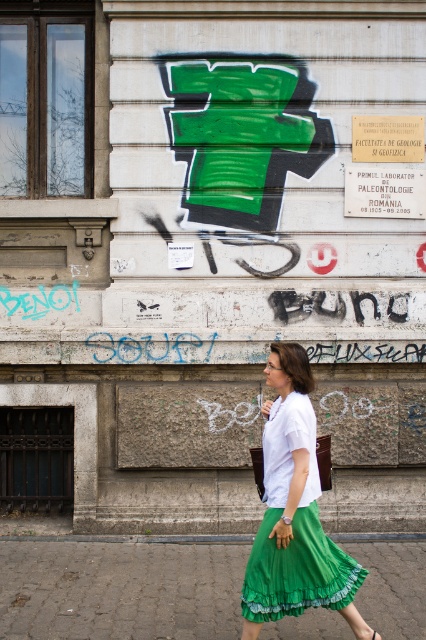
You are a fashion designer observing the woman in the image. You notice both the green satin skirt at center and the green fabric sandal at lower center. Which item is positioned higher on her body?

The green satin skirt at center is taller than the green fabric sandal at lower center, so the skirt is positioned higher on her body.

You are a fashion designer observing the woman in the image. You need to determine if the distance between the green satin skirt at center and the green fabric sandal at lower center is sufficient to allow a 50 cm long measuring tape to be placed between them without bending. Can you confirm this?

The distance between the green satin skirt at center and the green fabric sandal at lower center is 55.59 centimeters, which is longer than the 50 cm measuring tape. Therefore, the measuring tape can be placed between them without bending.

Based on the photo, you are a photographer taking a picture of the gray cobblestone pavement at lower center and the green satin skirt at center. Which object is located to the right side of the other?

The green satin skirt at center is located to the right side of the gray cobblestone pavement at lower center.